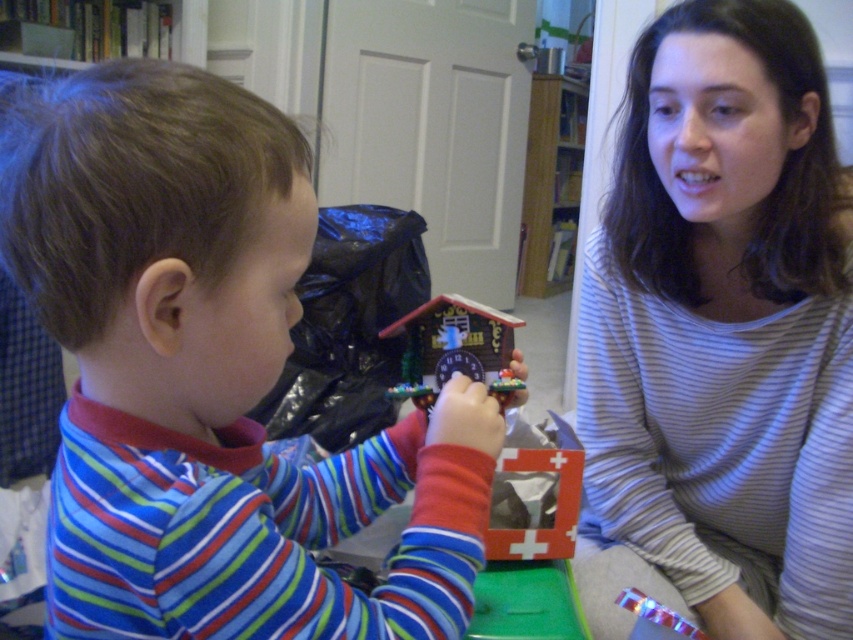
Is striped fabric shirt at left shorter than striped cotton shirt at center?

Yes, striped fabric shirt at left is shorter than striped cotton shirt at center.

What are the coordinates of `striped fabric shirt at left` in the screenshot? It's located at (210, 380).

Is point (253, 212) positioned before point (828, 525)?

Yes, it is.

Where is `striped fabric shirt at left`? striped fabric shirt at left is located at coordinates coord(210,380).

Does striped cotton shirt at center have a lesser height compared to wooden cuckoo clock at center?

No.

Who is shorter, striped cotton shirt at center or wooden cuckoo clock at center?

wooden cuckoo clock at center is shorter.

Where is `striped cotton shirt at center`? striped cotton shirt at center is located at coordinates (721, 336).

Can you confirm if striped fabric shirt at left is taller than wooden cuckoo clock at center?

Correct, striped fabric shirt at left is much taller as wooden cuckoo clock at center.

Is striped fabric shirt at left to the right of wooden cuckoo clock at center from the viewer's perspective?

Incorrect, striped fabric shirt at left is not on the right side of wooden cuckoo clock at center.

Which is behind, point (172, 248) or point (444, 376)?

Positioned behind is point (444, 376).

In order to click on striped fabric shirt at left in this screenshot , I will do `click(210, 380)`.